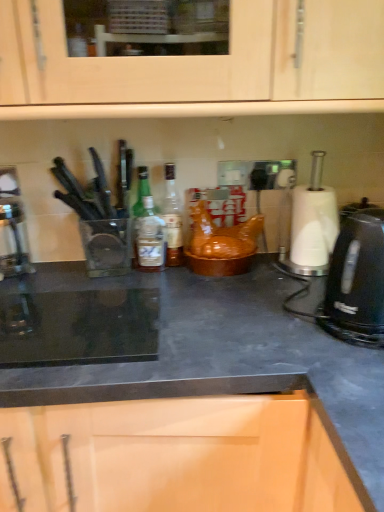
Where is `translucent glass bottle at center`? This screenshot has width=384, height=512. translucent glass bottle at center is located at coordinates (172, 219).

What do you see at coordinates (172, 219) in the screenshot? I see `translucent glass bottle at center` at bounding box center [172, 219].

The height and width of the screenshot is (512, 384). Identify the location of black matte countertop at center. (232, 349).

The height and width of the screenshot is (512, 384). What do you see at coordinates (232, 349) in the screenshot?
I see `black matte countertop at center` at bounding box center [232, 349].

Locate an element on the screen. The width and height of the screenshot is (384, 512). black plastic kettle at right is located at coordinates pyautogui.click(x=356, y=281).

Considering the relative positions of black matte countertop at center and black plastic kettle at right in the image provided, is black matte countertop at center to the left of black plastic kettle at right from the viewer's perspective?

Yes, black matte countertop at center is to the left of black plastic kettle at right.

Is point (74, 273) positioned in front of point (374, 221)?

No, it is behind (374, 221).

In terms of size, does black matte countertop at center appear bigger or smaller than black plastic kettle at right?

Clearly, black matte countertop at center is larger in size than black plastic kettle at right.

How many degrees apart are the facing directions of black matte countertop at center and black plastic kettle at right?

3.74 degrees separate the facing orientations of black matte countertop at center and black plastic kettle at right.

From a real-world perspective, does translucent glass bottle at center stand above metallic silver coffee machine at left?

Indeed, from a real-world perspective, translucent glass bottle at center stands above metallic silver coffee machine at left.

Is translucent glass bottle at center in contact with metallic silver coffee machine at left?

They are not placed beside each other.

From their relative heights in the image, would you say translucent glass bottle at center is taller or shorter than metallic silver coffee machine at left?

In the image, translucent glass bottle at center appears to be taller than metallic silver coffee machine at left.

Could you tell me if translucent glass bottle at center is turned towards metallic silver coffee machine at left?

No, translucent glass bottle at center is not aimed at metallic silver coffee machine at left.

This screenshot has width=384, height=512. Find the location of `countertop in front of the metallic silver coffee machine at left`. countertop in front of the metallic silver coffee machine at left is located at coordinates (232, 349).

Could you tell me if metallic silver coffee machine at left is facing black matte countertop at center?

No, metallic silver coffee machine at left is not aimed at black matte countertop at center.

Does point (17, 204) come behind point (245, 309)?

Yes, point (17, 204) is farther from viewer.

From a real-world perspective, which is physically below, metallic silver coffee machine at left or black matte countertop at center?

black matte countertop at center.

Is black matte countertop at center far from green glass bottle at center?

Answer: No, black matte countertop at center is not far from green glass bottle at center.

Does point (283, 286) appear closer or farther from the camera than point (147, 169)?

Point (283, 286) is positioned closer to the camera compared to point (147, 169).

Is black matte countertop at center facing towards green glass bottle at center?

→ No, black matte countertop at center is not oriented towards green glass bottle at center.

Does black matte countertop at center appear on the right side of metallic silver coffee machine at left?

Correct, you'll find black matte countertop at center to the right of metallic silver coffee machine at left.

How different are the orientations of black matte countertop at center and metallic silver coffee machine at left in degrees?

1.55 degrees.

Is black matte countertop at center in front of or behind metallic silver coffee machine at left in the image?

Visually, black matte countertop at center is located in front of metallic silver coffee machine at left.

Does translucent glass bottle at center appear on the left side of green glass bottle at center?

No.

Is translucent glass bottle at center not within green glass bottle at center?

Yes.

How much distance is there between translucent glass bottle at center and green glass bottle at center?

translucent glass bottle at center and green glass bottle at center are 2.15 inches apart from each other.

From the image's perspective, which object appears higher, translucent glass bottle at center or green glass bottle at center?

translucent glass bottle at center.

From a real-world perspective, between translucent glass bottle at center and black matte countertop at center, who is vertically higher?

translucent glass bottle at center is physically above.

Is point (167, 192) farther from camera compared to point (195, 372)?

Yes, it is.

Are translucent glass bottle at center and black matte countertop at center located far from each other?

No, translucent glass bottle at center is not far away from black matte countertop at center.

What's the angular difference between translucent glass bottle at center and black matte countertop at center's facing directions?

They differ by 1.55 degrees in their facing directions.

Identify the location of home appliance behind the black matte countertop at center. (356, 281).

I want to click on bottle above the metallic silver coffee machine at left (from the image's perspective), so click(172, 219).

When comparing their distances from green glass bottle at center, does black plastic kettle at right or black matte countertop at center seem closer?

Based on the image, black matte countertop at center appears to be nearer to green glass bottle at center.

Based on their spatial positions, is black matte countertop at center or translucent glass bottle at center closer to black plastic kettle at right?

black matte countertop at center.

From the picture: Estimate the real-world distances between objects in this image. Which object is further from green glass bottle at center, black plastic kettle at right or translucent glass bottle at center?

black plastic kettle at right is further to green glass bottle at center.

From the image, which object appears to be farther from black matte countertop at center, green glass bottle at center or metallic silver coffee machine at left?

The object further to black matte countertop at center is metallic silver coffee machine at left.

Estimate the real-world distances between objects in this image. Which object is closer to black plastic kettle at right, translucent glass bottle at center or metallic silver coffee machine at left?

Among the two, translucent glass bottle at center is located nearer to black plastic kettle at right.

Based on the photo, estimate the real-world distances between objects in this image. Which object is further from translucent glass bottle at center, black plastic kettle at right or black matte countertop at center?

The object further to translucent glass bottle at center is black plastic kettle at right.

Considering their positions, is metallic silver coffee machine at left positioned further to black matte countertop at center than translucent glass bottle at center?

Among the two, metallic silver coffee machine at left is located further to black matte countertop at center.

Looking at the image, which one is located further to black matte countertop at center, green glass bottle at center or black plastic kettle at right?

green glass bottle at center.

Find the location of a particular element. The image size is (384, 512). home appliance between green glass bottle at center and black matte countertop at center from top to bottom is located at coordinates (356, 281).

Find the location of a particular element. kitchen appliance between translucent glass bottle at center and black matte countertop at center in the up-down direction is located at coordinates (147, 228).

At what (x,y) coordinates should I click in order to perform the action: click on bottle between metallic silver coffee machine at left and black plastic kettle at right from left to right. Please return your answer as a coordinate pair (x, y). The width and height of the screenshot is (384, 512). Looking at the image, I should click on tap(172, 219).

I want to click on kitchen appliance between metallic silver coffee machine at left and translucent glass bottle at center in the horizontal direction, so click(x=147, y=228).